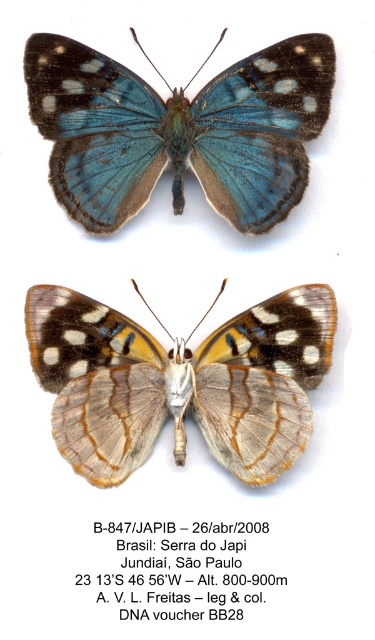
You are an entomologist observing two butterflies in a display case. You notice the blue iridescent wings at center and the translucent silver butterfly at center. Which butterfly is positioned closer to the front of the display?

The blue iridescent wings at center is closer to the viewer than the translucent silver butterfly at center, so it is positioned closer to the front of the display.

You are holding a ruler and want to measure the distance between you and the blue iridescent wings at center. If your ruler can only measure up to 4 feet, will it be sufficient?

The blue iridescent wings at center are 4.12 feet away from the viewer. Since the ruler can only measure up to 4 feet, it will not be sufficient to measure the full distance.

You are an entomologist examining two butterflies displayed in a museum. You notice the blue iridescent wings at center and the translucent silver butterfly at center. Based on their sizes, which one do you think has a narrower wingspan?

The blue iridescent wings at center has a narrower wingspan than the translucent silver butterfly at center because its width is less than the latter.